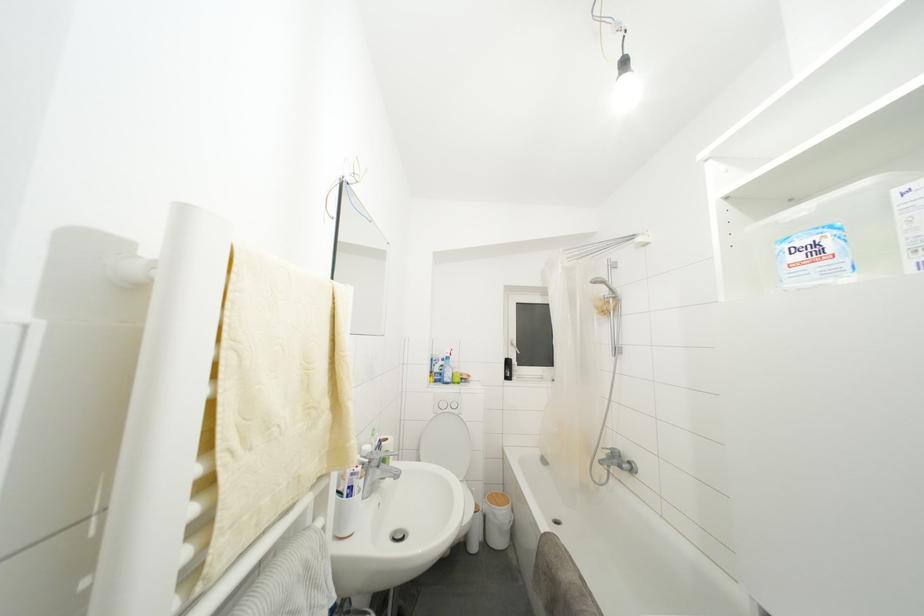
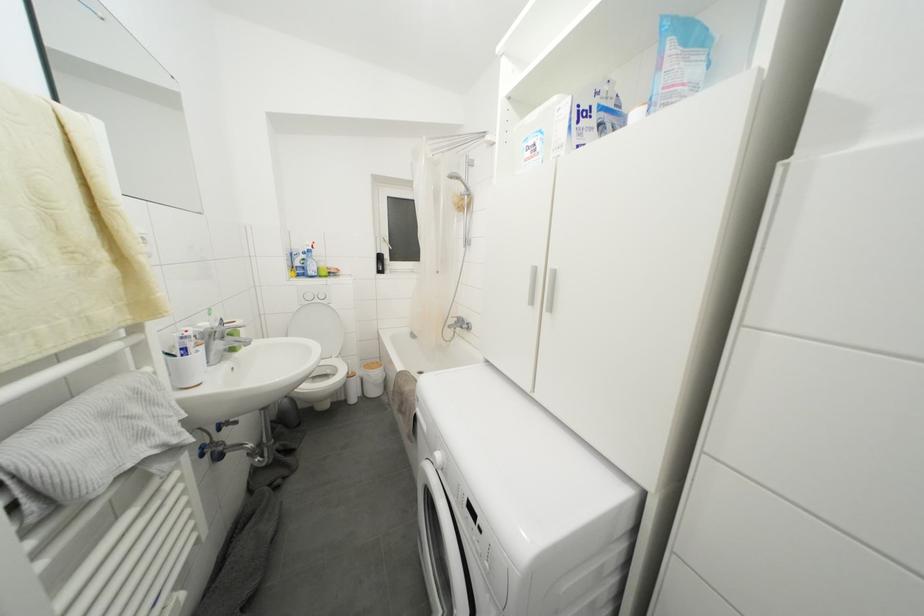
In the second image, find the point that corresponds to [608,286] in the first image.

(463, 182)